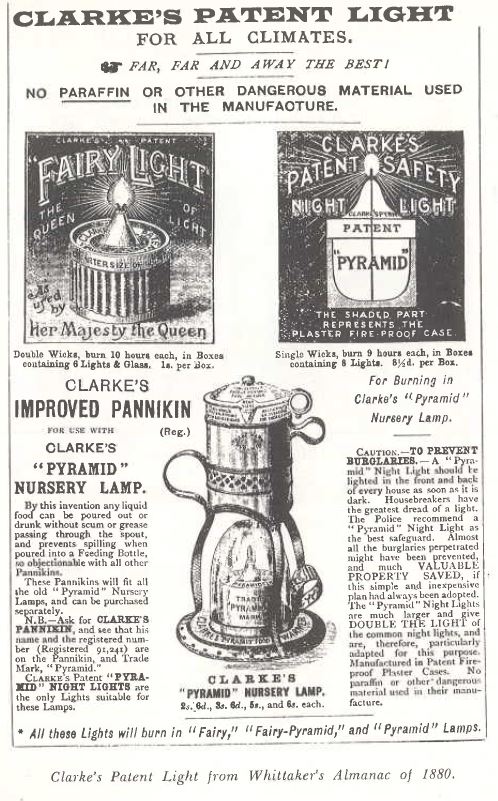
In order to click on fairy light lamp in this screenshot , I will do `click(114, 214)`.